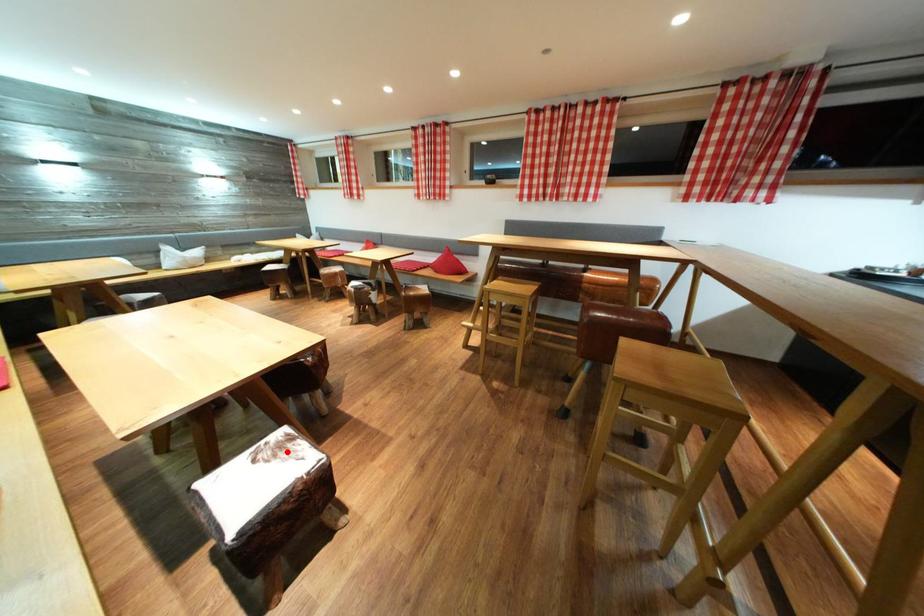
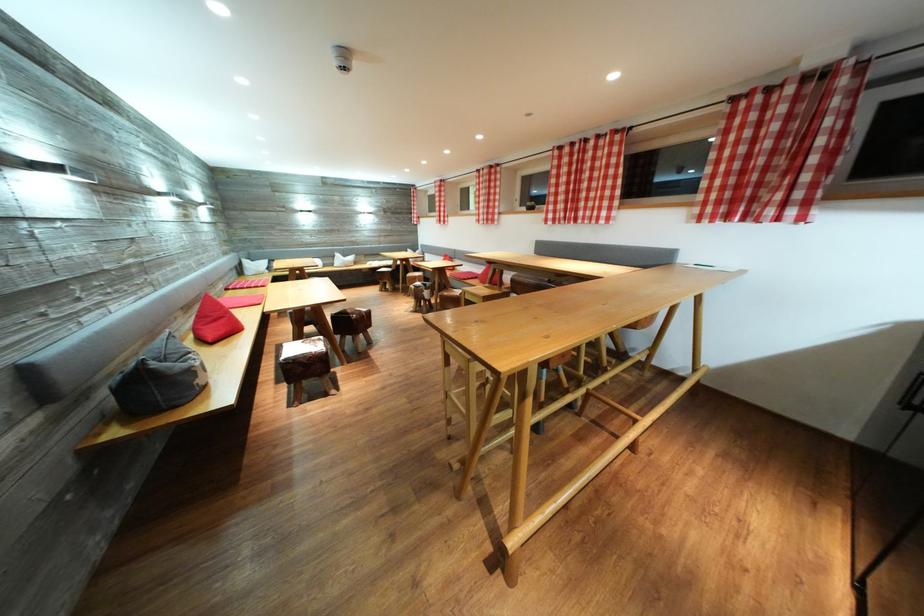
The point at the highlighted location is marked in the first image. Where is the corresponding point in the second image?

(321, 346)